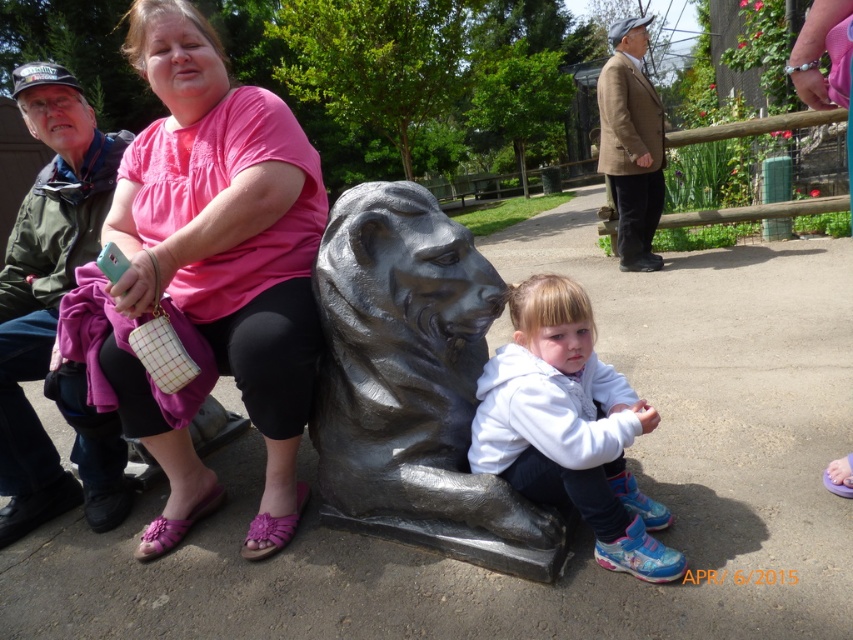
Is point (347, 433) positioned before point (610, 532)?

No, it is behind (610, 532).

From the picture: Is polished bronze lion at center further to the viewer compared to white fleece jacket at center?

Yes.

Which is in front, point (454, 348) or point (601, 378)?

Point (454, 348) is more forward.

Where is `polished bronze lion at center`? The width and height of the screenshot is (853, 640). polished bronze lion at center is located at coordinates (413, 385).

This screenshot has width=853, height=640. What do you see at coordinates (225, 236) in the screenshot?
I see `pink fabric shirt at upper left` at bounding box center [225, 236].

Is point (146, 202) less distant than point (605, 408)?

No, it is not.

What do you see at coordinates (225, 236) in the screenshot? I see `pink fabric shirt at upper left` at bounding box center [225, 236].

Identify the location of pink fabric shirt at upper left. (225, 236).

From the picture: Is pink fabric shirt at upper left to the left of polished bronze lion at center from the viewer's perspective?

Yes, pink fabric shirt at upper left is to the left of polished bronze lion at center.

Is pink fabric shirt at upper left behind polished bronze lion at center?

Yes, it is behind polished bronze lion at center.

Between point (263, 493) and point (381, 419), which one is positioned behind?

Positioned behind is point (263, 493).

Locate an element on the screen. The image size is (853, 640). pink fabric shirt at upper left is located at coordinates (225, 236).